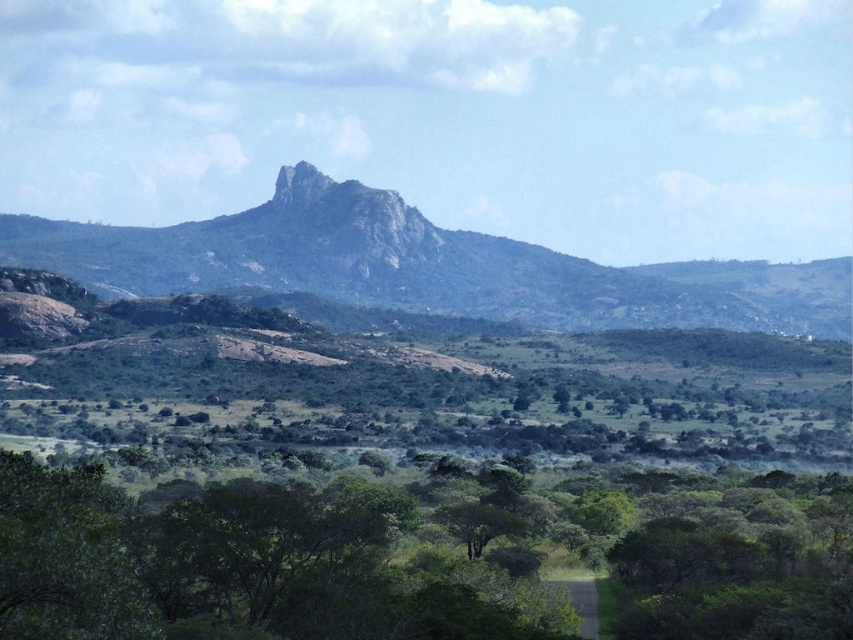
You are an environmental scientist assessing the landscape. You need to determine which object takes up more visual space in the image between the green leafy tree at lower center and the rugged rock mountain at center. Which one is larger in the image?

The rugged rock mountain at center occupies more visual space than the green leafy tree at lower center, so the rugged rock mountain at center is larger in the image.

You are a hiker standing at the base of the rugged rock mountain at center and want to reach the green leafy tree at lower center. Which direction should you move to get there?

The green leafy tree at lower center is positioned under the rugged rock mountain at center, so you should move downward towards the tree.

You are standing at the point marked by the coordinates (235, 564) in the image. What object is exactly at this location?

The green leafy tree at lower center is exactly at point (235, 564).